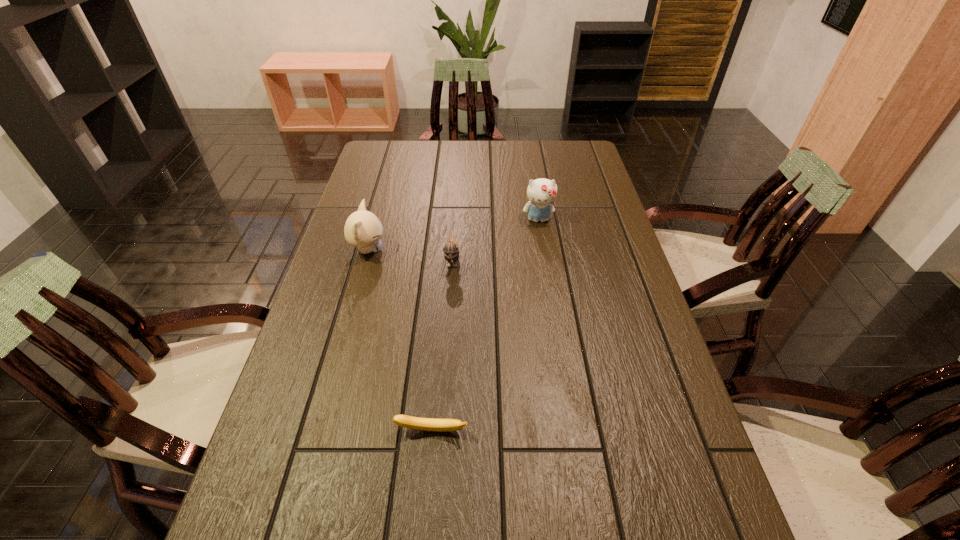
Locate an element on the screen. The width and height of the screenshot is (960, 540). vacant area between the third tallest object and the shortest object is located at coordinates (443, 345).

Where is `vacant region between the farthest object and the second shortest object`? This screenshot has width=960, height=540. vacant region between the farthest object and the second shortest object is located at coordinates (495, 239).

This screenshot has height=540, width=960. Identify the location of empty space that is in between the second kitten from right to left and the leftmost object. (410, 254).

The image size is (960, 540). I want to click on vacant space that's between the leftmost object and the shortest kitten, so click(x=410, y=254).

The image size is (960, 540). I want to click on free space between the shortest object and the rightmost object, so click(485, 325).

The height and width of the screenshot is (540, 960). I want to click on object that is the nearest to the second kitten from right to left, so click(x=363, y=229).

Identify the location of object that is the closest to the leftmost object. (450, 249).

Locate which kitten is the closest to the farthest kitten. Please provide its 2D coordinates. Your answer should be formatted as a tuple, i.e. [(x, y)], where the tuple contains the x and y coordinates of a point satisfying the conditions above.

[(450, 249)]

Identify the location of the second closest kitten to the rightmost kitten. This screenshot has width=960, height=540. (363, 229).

This screenshot has height=540, width=960. I want to click on vacant region that satisfies the following two spatial constraints: 1. on the front-facing side of the farthest kitten; 2. on the face of the leftmost object, so click(x=543, y=250).